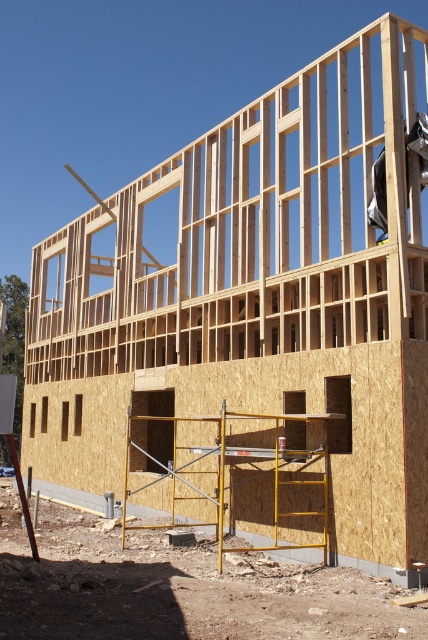
Find the location of a particular element. yellow metal scaffolding at lower center is located at coordinates (240, 476).

Is yellow metal scaffolding at lower center above dark gray fabric construction worker at upper right?

No.

Is point (187, 464) more distant than point (422, 125)?

Yes, it is behind point (422, 125).

In order to click on yellow metal scaffolding at lower center in this screenshot , I will do `click(240, 476)`.